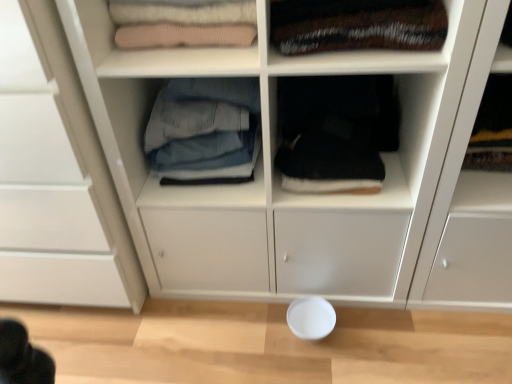
Where is `vacant point to the right of white matte bowl at lower center`? vacant point to the right of white matte bowl at lower center is located at coordinates (373, 332).